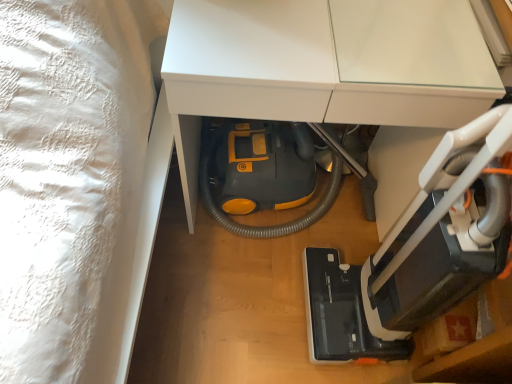
Locate an element on the screen. The image size is (512, 384). vacant region to the left of black plastic vacuum cleaner at lower right is located at coordinates (260, 313).